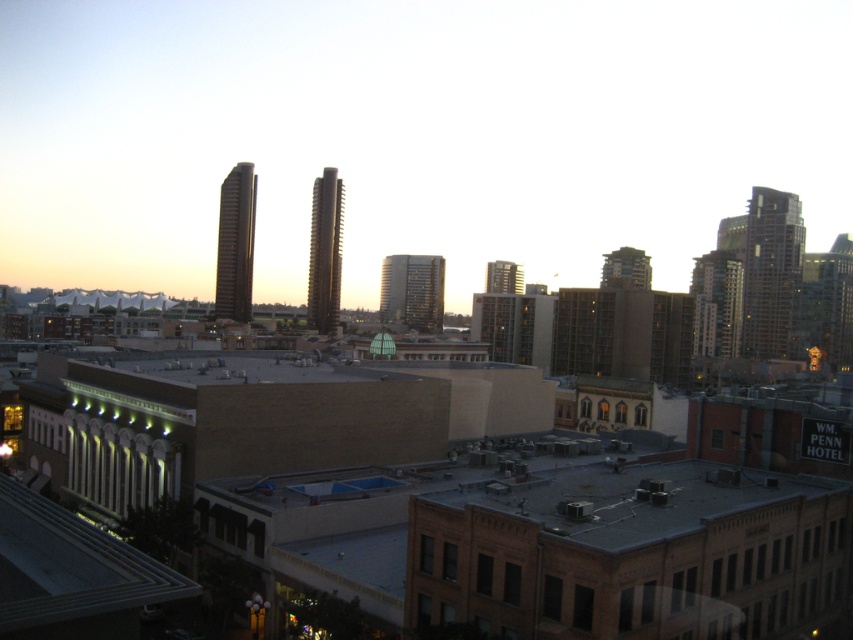
Question: Can you confirm if brown brick building at center is thinner than smooth glass skyscraper at center?

Choices:
 (A) yes
 (B) no

Answer: (B)

Question: Does brown brick building at center have a smaller size compared to smooth glass skyscraper at center?

Choices:
 (A) yes
 (B) no

Answer: (B)

Question: Is brown brick building at center smaller than smooth glass skyscraper at center?

Choices:
 (A) yes
 (B) no

Answer: (B)